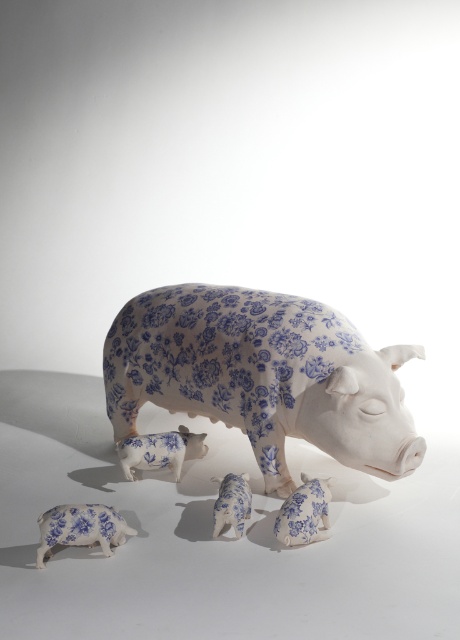
You are an art curator arranging an exhibition. You have two piglets, the blue and white porcelain piglet at lower left and the blue porcelain piglet at lower right. Which piglet requires a wider base to prevent tipping? Please explain your reasoning based on their sizes.

The blue and white porcelain piglet at lower left requires a wider base because it is wider than the blue porcelain piglet at lower right, as stated in the description. A wider base would provide better stability for the larger piglet.